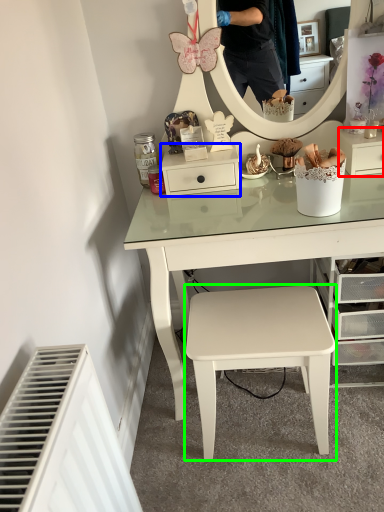
Question: Which is nearer to the shelf (highlighted by a red box)? shelf (highlighted by a blue box) or stool (highlighted by a green box).

Choices:
 (A) shelf
 (B) stool

Answer: (A)